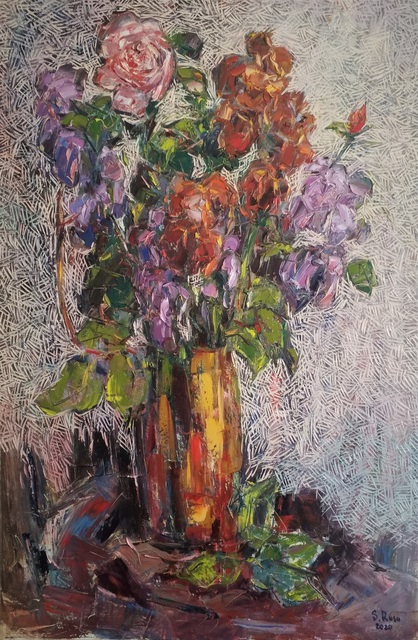
At what (x,y) coordinates should I click in order to perform the action: click on painting. Please return your answer as a coordinate pair (x, y). The image size is (418, 640). Looking at the image, I should click on (388, 393).